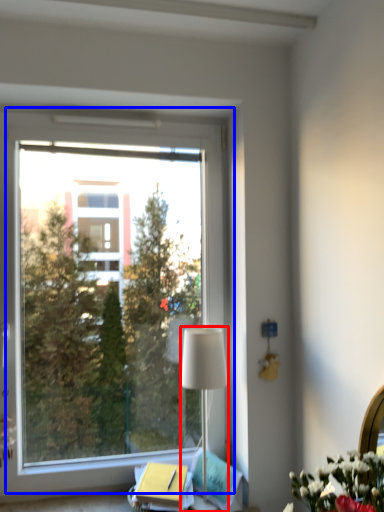
Question: Which object appears farthest to the camera in this image, lamp (highlighted by a red box) or window (highlighted by a blue box)?

Choices:
 (A) lamp
 (B) window

Answer: (B)